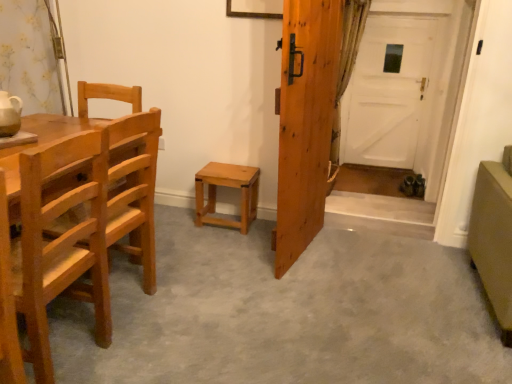
Locate an element on the screen. free location to the left of wooden door at center, which is counted as the 1th door, starting from the left is located at coordinates pyautogui.click(x=232, y=248).